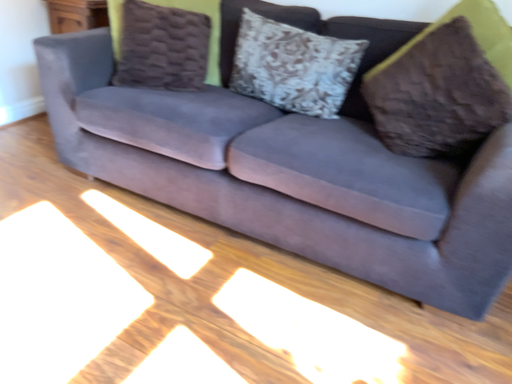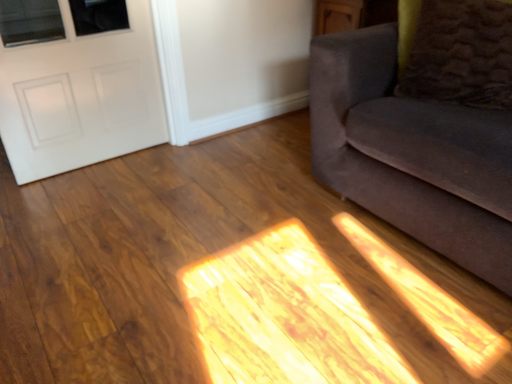
Question: How did the camera likely rotate when shooting the video?

Choices:
 (A) rotated right
 (B) rotated left

Answer: (B)